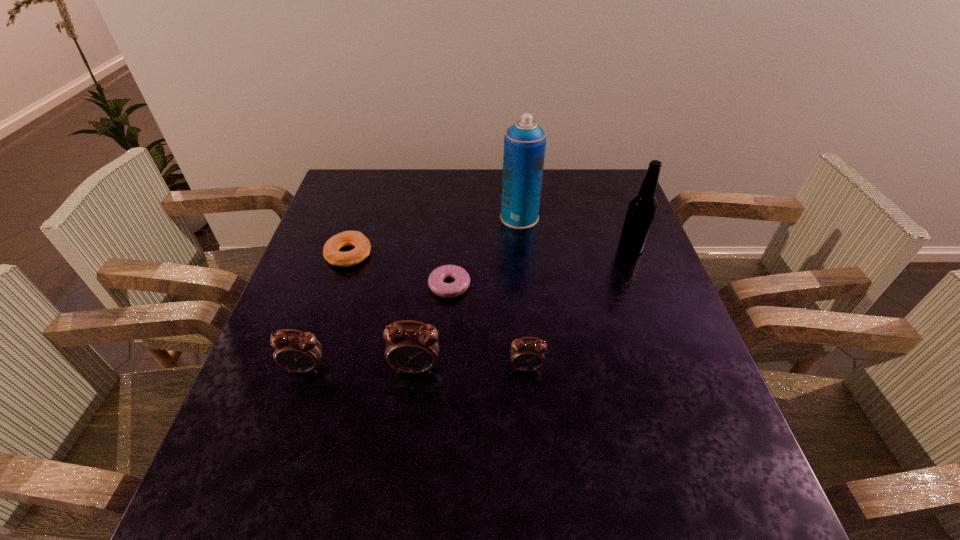
Find the location of a particular element. The width and height of the screenshot is (960, 540). alarm clock situated at the left edge is located at coordinates (301, 352).

The width and height of the screenshot is (960, 540). I want to click on bagel at the left edge, so click(x=331, y=252).

Find the location of a particular element. The width and height of the screenshot is (960, 540). object at the right edge is located at coordinates (642, 207).

Find the location of a particular element. This screenshot has height=540, width=960. free region at the far edge is located at coordinates (574, 204).

Where is `free space at the near edge`? free space at the near edge is located at coordinates (585, 451).

In the image, there is a desktop. At what (x,y) coordinates should I click in order to perform the action: click on vacant region at the left edge. Please return your answer as a coordinate pair (x, y). The width and height of the screenshot is (960, 540). Looking at the image, I should click on (348, 212).

You are a GUI agent. You are given a task and a screenshot of the screen. Output one action in this format:
    pyautogui.click(x=<x>, y=<y>)
    Task: Click on the vacant area at the right edge
    Image resolution: width=960 pixels, height=540 pixels.
    Given the screenshot: What is the action you would take?
    pyautogui.click(x=610, y=262)

This screenshot has height=540, width=960. In the image, there is a desktop. In order to click on vacant region at the far left corner in this screenshot , I will do `click(371, 176)`.

Locate an element on the screen. empty space between the bagel and the aerosol can is located at coordinates (434, 236).

This screenshot has width=960, height=540. Find the location of `empty space that is in between the sixth shortest object and the doughnut`. empty space that is in between the sixth shortest object and the doughnut is located at coordinates point(540,267).